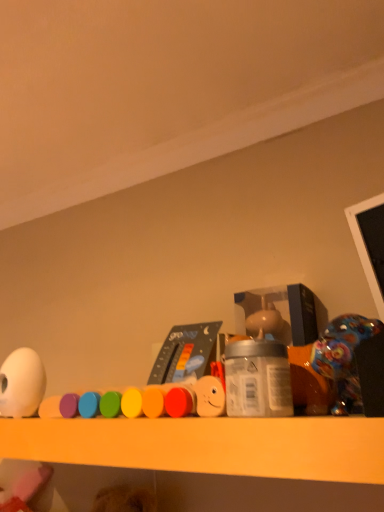
Question: From a real-world perspective, is white matte egg at left, arranged as the third toy when viewed from the right, physically below smooth plastic toy at center, which is counted as the second toy, starting from the left?

Choices:
 (A) yes
 (B) no

Answer: (B)

Question: Is white matte egg at left, which is the first toy from left to right, taller than smooth plastic toy at center, which is counted as the second toy, starting from the left?

Choices:
 (A) no
 (B) yes

Answer: (B)

Question: Is smooth plastic toy at center, which is counted as the second toy, starting from the left, at the back of white matte egg at left, which is the first toy from left to right?

Choices:
 (A) no
 (B) yes

Answer: (A)

Question: Considering the relative positions of white matte egg at left, arranged as the third toy when viewed from the right, and smooth plastic toy at center, which is counted as the second toy, starting from the left, in the image provided, is white matte egg at left, arranged as the third toy when viewed from the right, to the left of smooth plastic toy at center, which is counted as the second toy, starting from the left, from the viewer's perspective?

Choices:
 (A) no
 (B) yes

Answer: (B)

Question: From the image's perspective, is white matte egg at left, arranged as the third toy when viewed from the right, on top of smooth plastic toy at center, which is counted as the second toy, starting from the left?

Choices:
 (A) yes
 (B) no

Answer: (B)

Question: Does point (195, 402) appear closer or farther from the camera than point (246, 369)?

Choices:
 (A) farther
 (B) closer

Answer: (A)

Question: From the image's perspective, is smooth plastic toy at center, marked as the 2th toy in a right-to-left arrangement, above or below silver metallic jar at center?

Choices:
 (A) below
 (B) above

Answer: (A)

Question: From a real-world perspective, relative to silver metallic jar at center, is smooth plastic toy at center, which is counted as the second toy, starting from the left, vertically above or below?

Choices:
 (A) below
 (B) above

Answer: (A)

Question: Is smooth plastic toy at center, which is counted as the second toy, starting from the left, spatially inside silver metallic jar at center, or outside of it?

Choices:
 (A) outside
 (B) inside

Answer: (A)

Question: From a real-world perspective, is white matte egg at left, which is the first toy from left to right, positioned above or below silver metallic jar at center?

Choices:
 (A) above
 (B) below

Answer: (A)

Question: Considering their positions, is white matte egg at left, arranged as the third toy when viewed from the right, located in front of or behind silver metallic jar at center?

Choices:
 (A) front
 (B) behind

Answer: (B)

Question: Visually, is white matte egg at left, which is the first toy from left to right, positioned to the left or to the right of silver metallic jar at center?

Choices:
 (A) left
 (B) right

Answer: (A)

Question: From their relative heights in the image, would you say white matte egg at left, arranged as the third toy when viewed from the right, is taller or shorter than silver metallic jar at center?

Choices:
 (A) short
 (B) tall

Answer: (B)

Question: Would you say smooth plastic toy at center, which is counted as the second toy, starting from the left, is to the left or to the right of shiny plastic toy at right, arranged as the third toy when viewed from the left, in the picture?

Choices:
 (A) left
 (B) right

Answer: (A)

Question: Considering the positions of smooth plastic toy at center, marked as the 2th toy in a right-to-left arrangement, and shiny plastic toy at right, arranged as the third toy when viewed from the left, in the image, is smooth plastic toy at center, marked as the 2th toy in a right-to-left arrangement, wider or thinner than shiny plastic toy at right, arranged as the third toy when viewed from the left,?

Choices:
 (A) thin
 (B) wide

Answer: (A)